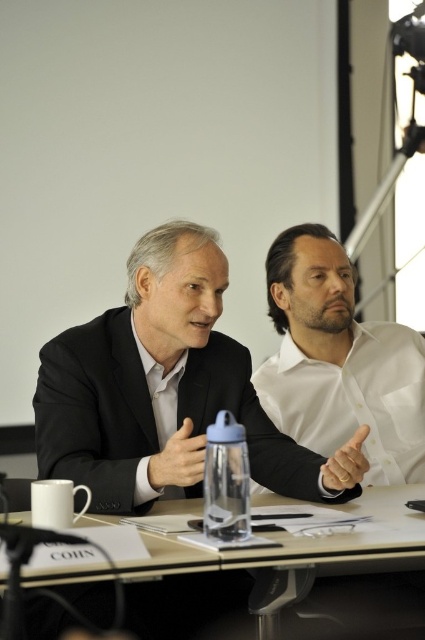
You are standing in the room and want to pick up an object located at point (345, 372). If your arm can reach up to 2 meters, can you reach it?

The distance of point (345, 372) from viewer is 1.98 meters, so yes, you can reach it since it is within your arm reach of 2 meters.

You are an observer looking at the two people seated at the table. Which of the two items, the black matte suit at center or the white glossy shirt at center, is positioned lower in the image?

The black matte suit at center is positioned lower than the white glossy shirt at center in the image.